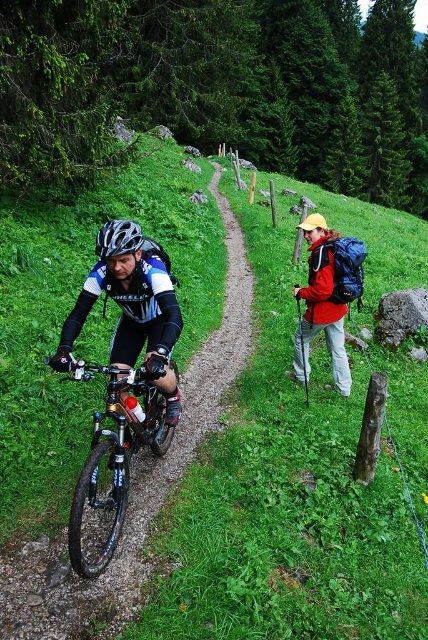
Question: Which object is the closest to the matte black jacket at right?

Choices:
 (A) shiny metallic bicycle at left
 (B) shiny black bicycle at center

Answer: (B)

Question: Estimate the real-world distances between objects in this image. Which object is closer to the matte black jacket at right?

Choices:
 (A) shiny black bicycle at center
 (B) matte black helmet at left
 (C) shiny metallic bicycle at left

Answer: (A)

Question: Which object is the closest to the matte black helmet at left?

Choices:
 (A) shiny black bicycle at center
 (B) matte black jacket at right
 (C) shiny metallic bicycle at left

Answer: (A)

Question: Is shiny black bicycle at center above matte black jacket at right?

Choices:
 (A) yes
 (B) no

Answer: (B)

Question: Does shiny black bicycle at center appear under shiny metallic bicycle at left?

Choices:
 (A) no
 (B) yes

Answer: (A)

Question: Can you confirm if shiny metallic bicycle at left is positioned to the left of matte black jacket at right?

Choices:
 (A) yes
 (B) no

Answer: (A)